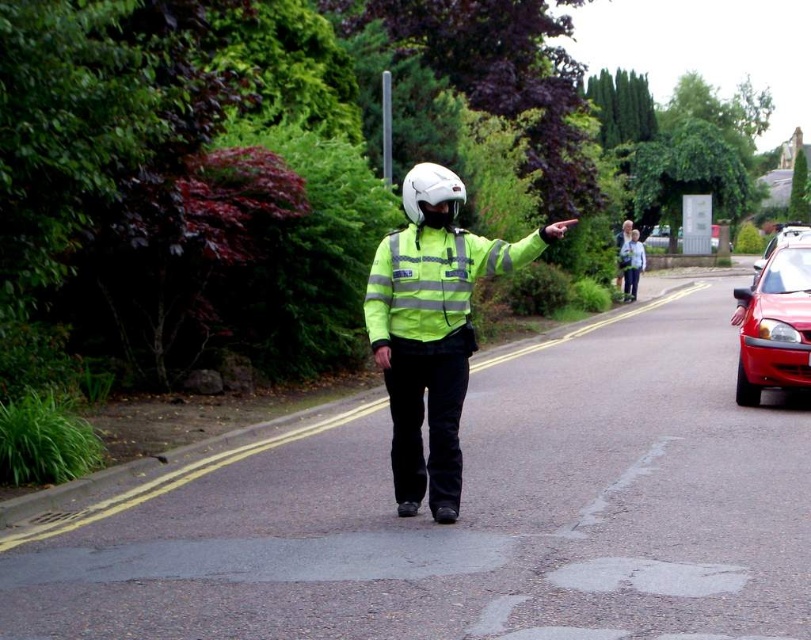
Is point (412, 195) in front of point (638, 276)?

Yes, it is in front of point (638, 276).

Which is in front, point (431, 204) or point (623, 248)?

Positioned in front is point (431, 204).

Is point (440, 179) behind point (634, 276)?

No, it is in front of (634, 276).

This screenshot has width=811, height=640. In order to click on white matte helmet at center in this screenshot , I will do `click(430, 189)`.

Does light blue fabric jacket at center have a larger size compared to metallic red car at right?

Actually, light blue fabric jacket at center might be smaller than metallic red car at right.

Is point (642, 259) behind point (753, 285)?

Yes, it is.

You are a GUI agent. You are given a task and a screenshot of the screen. Output one action in this format:
    pyautogui.click(x=<x>, y=<y>)
    Task: Click on the light blue fabric jacket at center
    
    Given the screenshot: What is the action you would take?
    pyautogui.click(x=631, y=264)

In the scene shown: Can you confirm if white matte helmet at center is positioned to the right of metallic red car at right?

No, white matte helmet at center is not to the right of metallic red car at right.

Describe the element at coordinates (430, 189) in the screenshot. I see `white matte helmet at center` at that location.

Where is `white matte helmet at center`? white matte helmet at center is located at coordinates (430, 189).